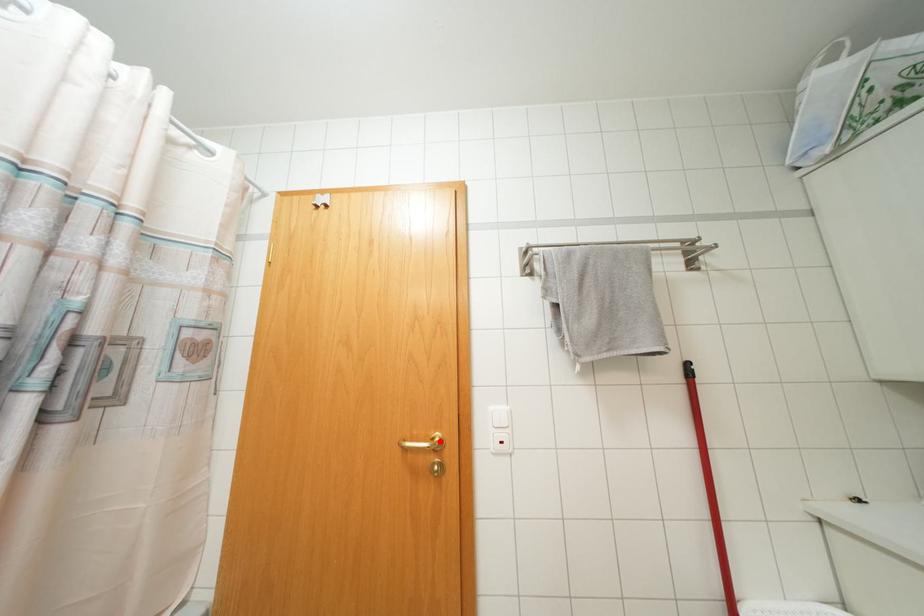
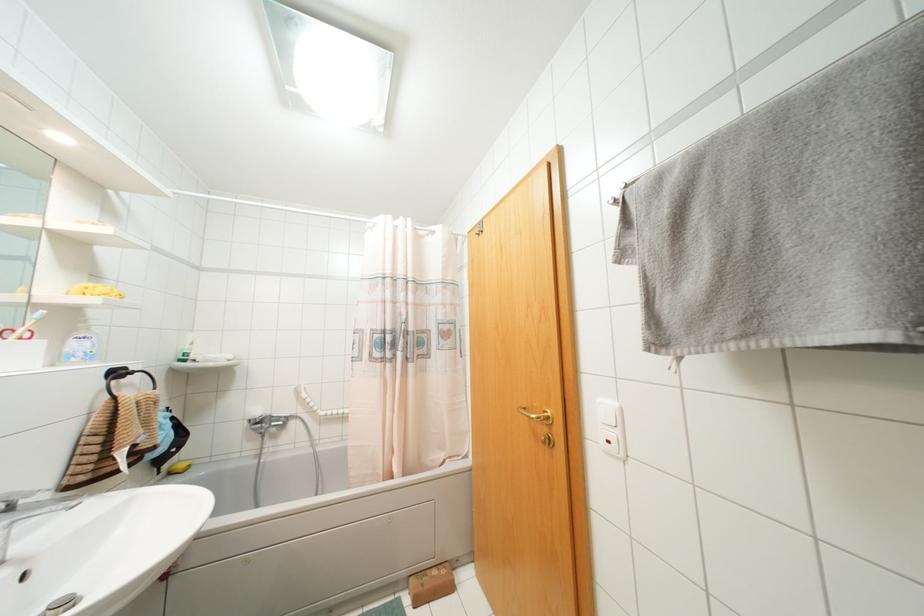
Find the pixel in the second image that matches the highlighted location in the first image.

(546, 416)